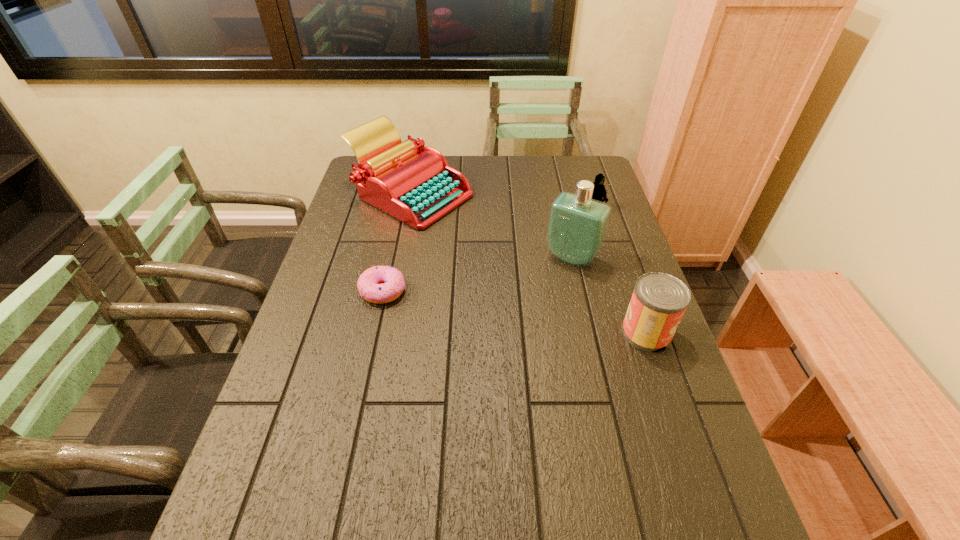
At what (x,y) coordinates should I click in order to perform the action: click on free space on the desktop that is between the doughnut and the third shortest object and is positioned on the front label of the third farthest object. Please return your answer as a coordinate pair (x, y). This screenshot has width=960, height=540. Looking at the image, I should click on (534, 315).

Identify the location of vacant space on the desktop that is between the doughnut and the can and is positioned on the face of the fourth tallest object. The width and height of the screenshot is (960, 540). (473, 305).

You are a GUI agent. You are given a task and a screenshot of the screen. Output one action in this format:
    pyautogui.click(x=<x>, y=<y>)
    Task: Click on the free spot on the desktop that is between the doughnut and the nearest object and is positioned on the typing side of the typewriter
    The width and height of the screenshot is (960, 540).
    Given the screenshot: What is the action you would take?
    pyautogui.click(x=470, y=305)